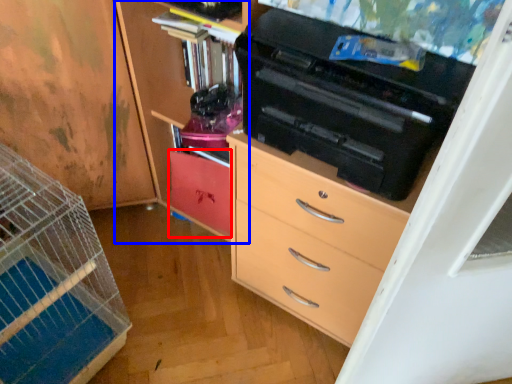
Question: Which object is closer to the camera taking this photo, cabinetry (highlighted by a red box) or cabinetry (highlighted by a blue box)?

Choices:
 (A) cabinetry
 (B) cabinetry

Answer: (B)